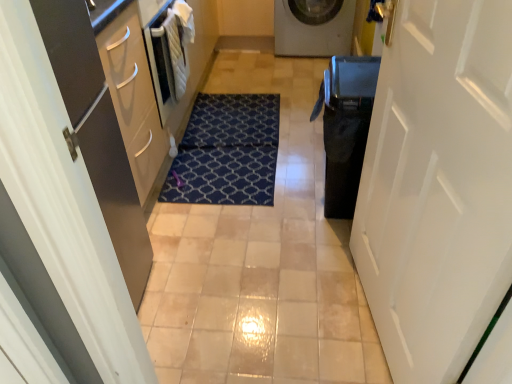
In order to face matte white door at left, the first door in the left-to-right sequence, should I rotate leftwards or rightwards?

Rotate left and turn 14.058 degrees.

This screenshot has width=512, height=384. What do you see at coordinates (68, 194) in the screenshot? I see `matte white door at left, the first door in the left-to-right sequence` at bounding box center [68, 194].

This screenshot has width=512, height=384. What do you see at coordinates (227, 152) in the screenshot?
I see `blue patterned mat at center` at bounding box center [227, 152].

What do you see at coordinates (313, 27) in the screenshot? I see `white glossy washing machine at upper center` at bounding box center [313, 27].

What do you see at coordinates (438, 186) in the screenshot? Image resolution: width=512 pixels, height=384 pixels. I see `white matte door at right, which ranks as the second door in left-to-right order` at bounding box center [438, 186].

Find the location of `black glossy dishwasher at right`. black glossy dishwasher at right is located at coordinates (345, 128).

Who is smaller, white matte door at right, which ranks as the second door in left-to-right order, or matte white door at left, placed as the second door when sorted from right to left?

white matte door at right, which ranks as the second door in left-to-right order, is smaller.

Which of these two, white matte door at right, the first door from the right, or matte white door at left, placed as the second door when sorted from right to left, stands shorter?

matte white door at left, placed as the second door when sorted from right to left.

At what (x,y) coordinates should I click in order to perform the action: click on door behind the white matte door at right, the first door from the right. Please return your answer as a coordinate pair (x, y). This screenshot has height=384, width=512. Looking at the image, I should click on (68, 194).

From a real-world perspective, relative to matte white door at left, the first door in the left-to-right sequence, is white matte door at right, which ranks as the second door in left-to-right order, vertically above or below?

Clearly, from a real-world perspective, white matte door at right, which ranks as the second door in left-to-right order, is above matte white door at left, the first door in the left-to-right sequence.

Can you confirm if gold metallic door handle at upper right is positioned to the right of blue patterned mat at center?

Yes.

This screenshot has height=384, width=512. Find the location of `doormat directly beneath the gold metallic door handle at upper right (from a real-world perspective)`. doormat directly beneath the gold metallic door handle at upper right (from a real-world perspective) is located at coordinates 227,152.

How many degrees apart are the facing directions of gold metallic door handle at upper right and blue patterned mat at center?

The angular difference between gold metallic door handle at upper right and blue patterned mat at center is 177 degrees.

Is blue patterned mat at center completely or partially inside gold metallic door handle at upper right?

No, gold metallic door handle at upper right does not contain blue patterned mat at center.

Is gold metallic door handle at upper right next to black glossy dishwasher at right and touching it?

They are not placed beside each other.

Is gold metallic door handle at upper right oriented away from black glossy dishwasher at right?

That's not correct — gold metallic door handle at upper right is not looking away from black glossy dishwasher at right.

In terms of height, does gold metallic door handle at upper right look taller or shorter compared to black glossy dishwasher at right?

gold metallic door handle at upper right is shorter than black glossy dishwasher at right.

Which is more to the left, gold metallic door handle at upper right or black glossy dishwasher at right?

From the viewer's perspective, black glossy dishwasher at right appears more on the left side.

Is white matte door at right, the first door from the right, oriented away from gold metallic door handle at upper right?

No, gold metallic door handle at upper right is not at the back of white matte door at right, the first door from the right.

From the image's perspective, is white matte door at right, which ranks as the second door in left-to-right order, located above or below gold metallic door handle at upper right?

Based on their image positions, white matte door at right, which ranks as the second door in left-to-right order, is located beneath gold metallic door handle at upper right.

From their relative heights in the image, would you say white glossy washing machine at upper center is taller or shorter than gold metallic door handle at upper right?

white glossy washing machine at upper center is taller than gold metallic door handle at upper right.

Between white glossy washing machine at upper center and gold metallic door handle at upper right, which one has smaller width?

With smaller width is gold metallic door handle at upper right.

Can you confirm if white glossy washing machine at upper center is positioned to the left of gold metallic door handle at upper right?

Yes.

Which object is more forward, white glossy washing machine at upper center or gold metallic door handle at upper right?

gold metallic door handle at upper right is closer to the camera.

Is white glossy washing machine at upper center behind matte white door at left, placed as the second door when sorted from right to left?

Yes, the depth of white glossy washing machine at upper center is greater than that of matte white door at left, placed as the second door when sorted from right to left.

From a real-world perspective, who is located lower, white glossy washing machine at upper center or matte white door at left, the first door in the left-to-right sequence?

From a 3D spatial view, white glossy washing machine at upper center is below.

Does white glossy washing machine at upper center have a greater height compared to matte white door at left, the first door in the left-to-right sequence?

No, white glossy washing machine at upper center is not taller than matte white door at left, the first door in the left-to-right sequence.

Does white glossy washing machine at upper center turn towards matte white door at left, the first door in the left-to-right sequence?

No, white glossy washing machine at upper center does not turn towards matte white door at left, the first door in the left-to-right sequence.

Locate an element on the screen. This screenshot has height=384, width=512. washing machine behind the white matte door at right, which ranks as the second door in left-to-right order is located at coordinates (313, 27).

Does point (450, 285) come farther from viewer compared to point (350, 3)?

No, (450, 285) is in front of (350, 3).

Considering the sizes of white matte door at right, which ranks as the second door in left-to-right order, and white glossy washing machine at upper center in the image, is white matte door at right, which ranks as the second door in left-to-right order, wider or thinner than white glossy washing machine at upper center?

white matte door at right, which ranks as the second door in left-to-right order, is thinner than white glossy washing machine at upper center.

Are white matte door at right, the first door from the right, and white glossy washing machine at upper center making contact?

No, white matte door at right, the first door from the right, is not with white glossy washing machine at upper center.

This screenshot has height=384, width=512. Find the location of `door that appears in front of the matte white door at left, the first door in the left-to-right sequence`. door that appears in front of the matte white door at left, the first door in the left-to-right sequence is located at coordinates (438, 186).

Find the location of a particular element. This screenshot has width=512, height=384. doormat lying below the gold metallic door handle at upper right (from the image's perspective) is located at coordinates (227, 152).

Considering their positions, is black glossy dishwasher at right positioned further to white matte door at right, which ranks as the second door in left-to-right order, than blue patterned mat at center?

Among the two, blue patterned mat at center is located further to white matte door at right, which ranks as the second door in left-to-right order.

Considering their positions, is white glossy washing machine at upper center positioned further to matte white door at left, placed as the second door when sorted from right to left, than blue patterned mat at center?

The object further to matte white door at left, placed as the second door when sorted from right to left, is white glossy washing machine at upper center.

Which object lies further to the anchor point matte white door at left, the first door in the left-to-right sequence, gold metallic door handle at upper right or white glossy washing machine at upper center?

Based on the image, white glossy washing machine at upper center appears to be further to matte white door at left, the first door in the left-to-right sequence.

From the image, which object appears to be farther from blue patterned mat at center, black glossy dishwasher at right or matte white door at left, the first door in the left-to-right sequence?

matte white door at left, the first door in the left-to-right sequence, is further to blue patterned mat at center.

Looking at this image, considering their positions, is white matte door at right, the first door from the right, positioned closer to gold metallic door handle at upper right than white glossy washing machine at upper center?

white matte door at right, the first door from the right, lies closer to gold metallic door handle at upper right than the other object.

Which object lies nearer to the anchor point blue patterned mat at center, matte white door at left, the first door in the left-to-right sequence, or white matte door at right, the first door from the right?

white matte door at right, the first door from the right, is closer to blue patterned mat at center.

From the image, which object appears to be farther from white glossy washing machine at upper center, white matte door at right, which ranks as the second door in left-to-right order, or blue patterned mat at center?

white matte door at right, which ranks as the second door in left-to-right order.

Which object lies further to the anchor point blue patterned mat at center, matte white door at left, the first door in the left-to-right sequence, or white glossy washing machine at upper center?

matte white door at left, the first door in the left-to-right sequence, lies further to blue patterned mat at center than the other object.

This screenshot has width=512, height=384. In order to click on dish washer located between white matte door at right, which ranks as the second door in left-to-right order, and white glossy washing machine at upper center in the depth direction in this screenshot , I will do `click(345, 128)`.

You are a GUI agent. You are given a task and a screenshot of the screen. Output one action in this format:
    pyautogui.click(x=<x>, y=<y>)
    Task: Click on the doormat between matte white door at left, the first door in the left-to-right sequence, and white glossy washing machine at upper center from front to back
    
    Given the screenshot: What is the action you would take?
    [227, 152]

The image size is (512, 384). Find the location of `dish washer between matte white door at left, placed as the second door when sorted from right to left, and white matte door at right, which ranks as the second door in left-to-right order, in the horizontal direction`. dish washer between matte white door at left, placed as the second door when sorted from right to left, and white matte door at right, which ranks as the second door in left-to-right order, in the horizontal direction is located at coordinates (345, 128).

The height and width of the screenshot is (384, 512). Identify the location of dish washer between white matte door at right, the first door from the right, and gold metallic door handle at upper right from front to back. (345, 128).